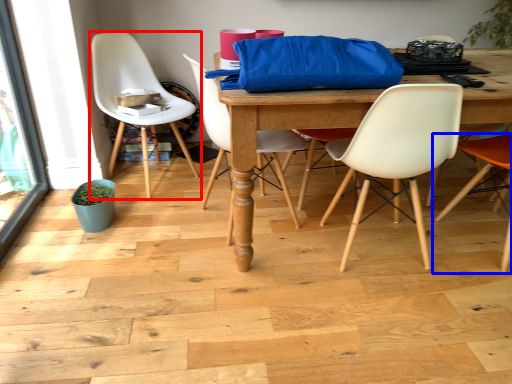
Question: Among these objects, which one is farthest to the camera, chair (highlighted by a red box) or chair (highlighted by a blue box)?

Choices:
 (A) chair
 (B) chair

Answer: (A)